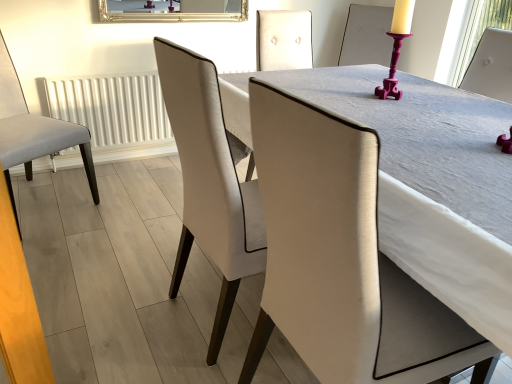
Where is `free region under light gray fabric chair at left, the second chair viewed from the right (from a real-world perspective)`? The image size is (512, 384). free region under light gray fabric chair at left, the second chair viewed from the right (from a real-world perspective) is located at coordinates (42, 205).